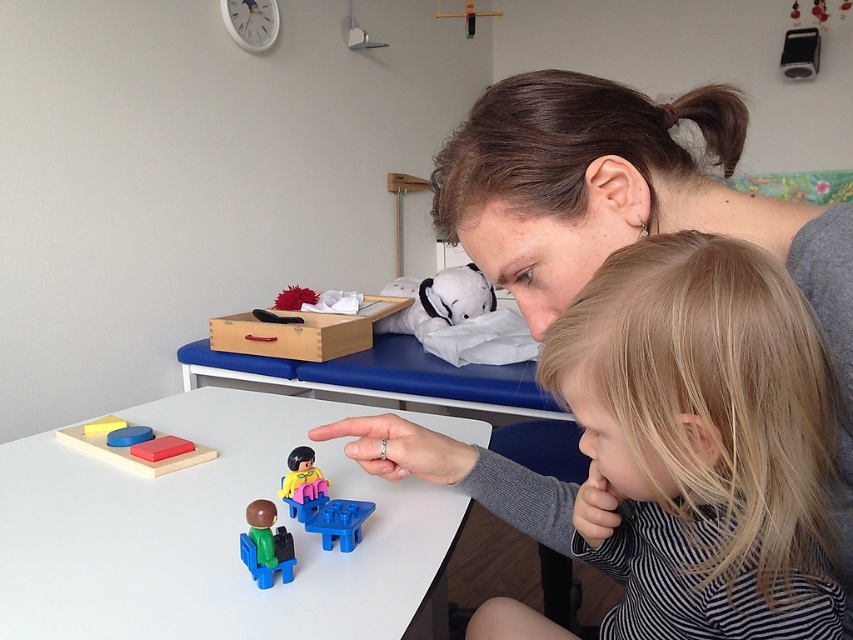
Measure the distance between blonde hair at upper right and yellow matte block at upper left.

A distance of 31.60 inches exists between blonde hair at upper right and yellow matte block at upper left.

Which is more to the left, blonde hair at upper right or yellow matte block at upper left?

Positioned to the left is yellow matte block at upper left.

This screenshot has height=640, width=853. I want to click on blonde hair at upper right, so click(672, 444).

Is white plastic table at center below green plastic toy at center?

No.

Is white plastic table at center shorter than green plastic toy at center?

In fact, white plastic table at center may be taller than green plastic toy at center.

This screenshot has width=853, height=640. In order to click on white plastic table at center in this screenshot , I will do `click(207, 532)`.

Identify the location of white plastic table at center. The image size is (853, 640). (207, 532).

Can you confirm if blonde hair at upper right is bigger than blue plastic table at center?

Correct, blonde hair at upper right is larger in size than blue plastic table at center.

What do you see at coordinates (672, 444) in the screenshot?
I see `blonde hair at upper right` at bounding box center [672, 444].

Identify the location of blonde hair at upper right. This screenshot has width=853, height=640. (672, 444).